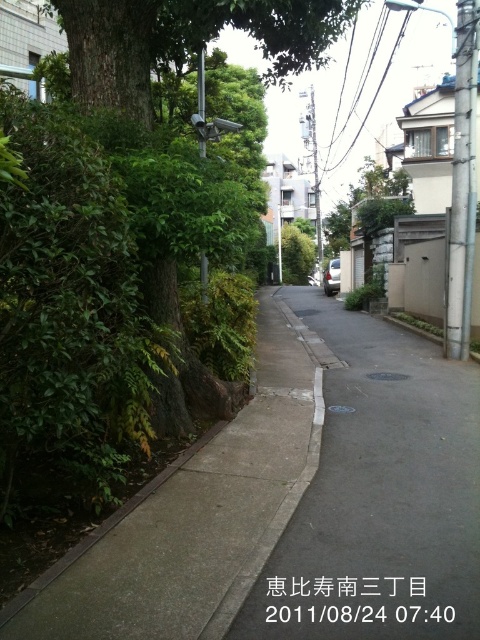
You are a pedestrian standing on the sidewalk and want to walk to the building on the right. The gray asphalt pavement at center and the green leafy tree at center are in your path. Which object should you avoid stepping on to reach the building safely?

You should avoid stepping on the gray asphalt pavement at center because it is in front of the green leafy tree at center, meaning the tree is behind the pavement. The pavement is the path you should walk on, so you don not need to avoid it. Wait, this seems contradictory. Let me rephrase. Since the gray asphalt pavement at center is in front of the green leafy tree, the tree is behind the pavement. Therefore, to reach the building on the right, you should stay on the pavement and avoid stepping onto the...